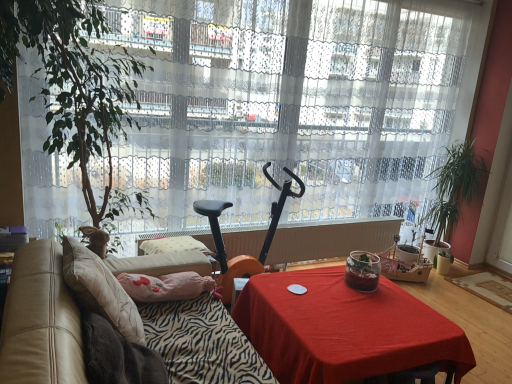
What do you see at coordinates (265, 237) in the screenshot?
I see `black plastic mobility scooter at center` at bounding box center [265, 237].

This screenshot has height=384, width=512. What do you see at coordinates (294, 104) in the screenshot?
I see `white sheer curtain at center` at bounding box center [294, 104].

This screenshot has height=384, width=512. Describe the element at coordinates (74, 84) in the screenshot. I see `green leafy plant at left, marked as the first houseplant in a front-to-back arrangement` at that location.

Describe the element at coordinates (344, 329) in the screenshot. I see `red fabric table at center` at that location.

What do you see at coordinates (40, 321) in the screenshot? I see `leather at left` at bounding box center [40, 321].

Image resolution: width=512 pixels, height=384 pixels. What do you see at coordinates (100, 290) in the screenshot?
I see `beige fabric pillow at left` at bounding box center [100, 290].

The width and height of the screenshot is (512, 384). Identify the location of black plastic mobility scooter at center. (265, 237).

Where is `desk that appears below the orange plastic radiator at center (from the image's perspective)`? desk that appears below the orange plastic radiator at center (from the image's perspective) is located at coordinates (344, 329).

Which object is further away from the camera, red fabric table at center or orange plastic radiator at center?

orange plastic radiator at center is behind.

Is red fabric table at center positioned with its back to orange plastic radiator at center?

Yes, orange plastic radiator at center is at the back of red fabric table at center.

From the image's perspective, between beige fabric pillow at left and black plastic mobility scooter at center, which one is located above?

black plastic mobility scooter at center appears higher in the image.

Is beige fabric pillow at left next to black plastic mobility scooter at center and touching it?

No, beige fabric pillow at left is not touching black plastic mobility scooter at center.

From a real-world perspective, is beige fabric pillow at left located higher than black plastic mobility scooter at center?

Indeed, from a real-world perspective, beige fabric pillow at left stands above black plastic mobility scooter at center.

Is beige fabric pillow at left shorter than black plastic mobility scooter at center?

Correct, beige fabric pillow at left is not as tall as black plastic mobility scooter at center.

Which of these two, leather at left or beige fabric pillow at left, is smaller?

beige fabric pillow at left is smaller.

Is leather at left located outside beige fabric pillow at left?

Yes, leather at left is not within beige fabric pillow at left.

In the image, is leather at left positioned in front of or behind beige fabric pillow at left?

leather at left is in front of beige fabric pillow at left.

Find the location of a particular element. This screenshot has width=512, height=384. pillow lying behind the leather at left is located at coordinates (100, 290).

Is leather at left at the left side of orange plastic radiator at center?

Yes, leather at left is to the left of orange plastic radiator at center.

Is leather at left bigger than orange plastic radiator at center?

Correct, leather at left is larger in size than orange plastic radiator at center.

Is leather at left further to the viewer compared to orange plastic radiator at center?

No, leather at left is in front of orange plastic radiator at center.

Considering the relative positions of orange plastic radiator at center and zebra-patterned fabric at lower left in the image provided, is orange plastic radiator at center to the left or to the right of zebra-patterned fabric at lower left?

Clearly, orange plastic radiator at center is on the right of zebra-patterned fabric at lower left in the image.

Could you tell me if orange plastic radiator at center is turned towards zebra-patterned fabric at lower left?

No, orange plastic radiator at center is not facing towards zebra-patterned fabric at lower left.

Which object is closer to the camera, orange plastic radiator at center or zebra-patterned fabric at lower left?

zebra-patterned fabric at lower left.

What's the angular difference between orange plastic radiator at center and zebra-patterned fabric at lower left's facing directions?

The facing directions of orange plastic radiator at center and zebra-patterned fabric at lower left are 84.4 degrees apart.

In the image, is leather at left positioned in front of or behind red fabric table at center?

In the image, leather at left appears in front of red fabric table at center.

Choose the correct answer: Is leather at left inside red fabric table at center or outside it?

leather at left is outside red fabric table at center.

Can you confirm if leather at left is smaller than red fabric table at center?

Actually, leather at left might be larger than red fabric table at center.

From the picture: Does leather at left have a greater height compared to red fabric table at center?

Correct, leather at left is much taller as red fabric table at center.

Can you confirm if orange plastic radiator at center is thinner than green leafy plant at right, the first houseplant in the right-to-left sequence?

Correct, the width of orange plastic radiator at center is less than that of green leafy plant at right, the first houseplant in the right-to-left sequence.

From a real-world perspective, between orange plastic radiator at center and green leafy plant at right, the second houseplant when ordered from left to right, who is vertically higher?

From a 3D spatial view, green leafy plant at right, the second houseplant when ordered from left to right, is above.

How much distance is there between orange plastic radiator at center and green leafy plant at right, the 1th houseplant viewed from the back?

The distance of orange plastic radiator at center from green leafy plant at right, the 1th houseplant viewed from the back, is 28.09 inches.

Image resolution: width=512 pixels, height=384 pixels. I want to click on radiator in front of the green leafy plant at right, the 1th houseplant viewed from the back, so click(331, 239).

Where is `desk below the orange plastic radiator at center (from a real-world perspective)`? desk below the orange plastic radiator at center (from a real-world perspective) is located at coordinates (344, 329).

Image resolution: width=512 pixels, height=384 pixels. Identify the location of mobility scooter that appears above the beige fabric pillow at left (from the image's perspective). [265, 237].

In the scene shown: When comparing their distances from zebra-patterned fabric at lower left, does black plastic mobility scooter at center or orange plastic radiator at center seem further?

orange plastic radiator at center.

Considering their positions, is green leafy plant at left, marked as the second houseplant in a right-to-left arrangement, positioned further to black plastic mobility scooter at center than white sheer curtain at center?

The object further to black plastic mobility scooter at center is green leafy plant at left, marked as the second houseplant in a right-to-left arrangement.

Estimate the real-world distances between objects in this image. Which object is closer to white sheer curtain at center, red fabric table at center or green leafy plant at left, the second houseplant when ordered from back to front?

green leafy plant at left, the second houseplant when ordered from back to front, lies closer to white sheer curtain at center than the other object.

Based on their spatial positions, is red fabric table at center or orange plastic radiator at center further from beige fabric pillow at left?

orange plastic radiator at center lies further to beige fabric pillow at left than the other object.

Considering their positions, is black plastic mobility scooter at center positioned further to red fabric table at center than white sheer curtain at center?

white sheer curtain at center is positioned further to the anchor red fabric table at center.

Based on their spatial positions, is green leafy plant at left, marked as the second houseplant in a right-to-left arrangement, or black plastic mobility scooter at center further from beige fabric pillow at left?

Among the two, black plastic mobility scooter at center is located further to beige fabric pillow at left.

Based on their spatial positions, is zebra-patterned fabric at lower left or beige fabric pillow at left closer to leather at left?

The object closer to leather at left is zebra-patterned fabric at lower left.

When comparing their distances from zebra-patterned fabric at lower left, does beige fabric pillow at left or green leafy plant at right, the 2th houseplant in the front-to-back sequence, seem closer?

Among the two, beige fabric pillow at left is located nearer to zebra-patterned fabric at lower left.

I want to click on houseplant between zebra-patterned fabric at lower left and black plastic mobility scooter at center in the front-back direction, so click(74, 84).

Find the location of a particular element. The image size is (512, 384). desk positioned between leather at left and green leafy plant at right, the 2th houseplant in the front-to-back sequence, from near to far is located at coordinates (344, 329).

Where is `mobility scooter between zebra-patterned fabric at lower left and orange plastic radiator at center in the front-back direction`? Image resolution: width=512 pixels, height=384 pixels. mobility scooter between zebra-patterned fabric at lower left and orange plastic radiator at center in the front-back direction is located at coordinates (265, 237).

The width and height of the screenshot is (512, 384). I want to click on radiator located between leather at left and green leafy plant at right, the 2th houseplant in the front-to-back sequence, in the depth direction, so click(331, 239).